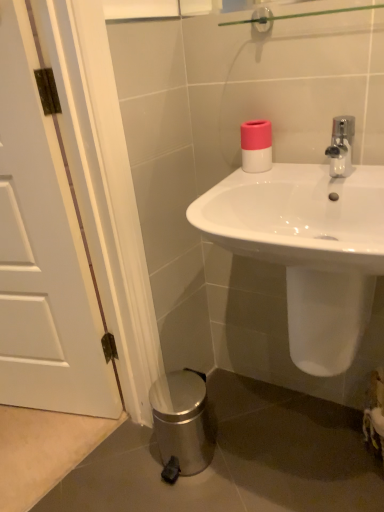
The width and height of the screenshot is (384, 512). In order to click on vacant space underneath white glossy sink at center (from a real-world perspective) in this screenshot , I will do `click(308, 452)`.